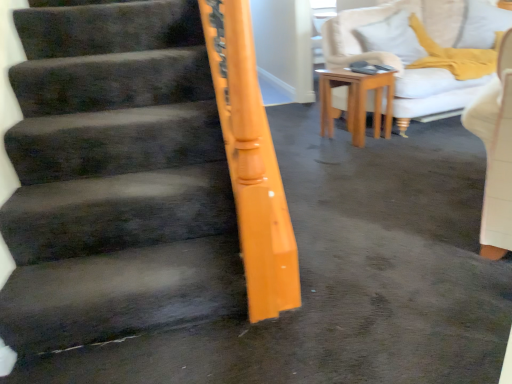
This screenshot has width=512, height=384. What do you see at coordinates (355, 101) in the screenshot? I see `light brown wooden table at center` at bounding box center [355, 101].

I want to click on light brown wooden table at center, so click(355, 101).

Identify the location of white soft pillow at upper right. (392, 37).

What do you see at coordinates (392, 37) in the screenshot? This screenshot has height=384, width=512. I see `white soft pillow at upper right` at bounding box center [392, 37].

Where is `light brown wooden table at center`? The width and height of the screenshot is (512, 384). light brown wooden table at center is located at coordinates (355, 101).

Can you confirm if white soft pillow at upper right is positioned to the right of light brown wooden table at center?

Indeed, white soft pillow at upper right is positioned on the right side of light brown wooden table at center.

Is white soft pillow at upper right in front of or behind light brown wooden table at center in the image?

In the image, white soft pillow at upper right appears behind light brown wooden table at center.

Between point (398, 41) and point (332, 86), which one is positioned behind?

Positioned behind is point (398, 41).

From the image's perspective, is white soft pillow at upper right located above or below light brown wooden table at center?

white soft pillow at upper right is situated higher than light brown wooden table at center in the image.

Looking at this image, from a real-world perspective, which is physically above, white soft pillow at upper right or light brown wooden table at center?

white soft pillow at upper right, from a real-world perspective.

Between white soft pillow at upper right and light brown wooden table at center, which one has larger width?

light brown wooden table at center.

Considering the sizes of white soft pillow at upper right and light brown wooden table at center in the image, is white soft pillow at upper right taller or shorter than light brown wooden table at center?

In the image, white soft pillow at upper right appears to be shorter than light brown wooden table at center.

Between white soft pillow at upper right and light brown wooden table at center, which one has smaller size?

light brown wooden table at center.

Would you say white soft pillow at upper right contains light brown wooden table at center?

That's incorrect, light brown wooden table at center is not inside white soft pillow at upper right.

Does white soft pillow at upper right touch light brown wooden table at center?

No, white soft pillow at upper right is not touching light brown wooden table at center.

Does white soft pillow at upper right turn towards light brown wooden table at center?

No.

Can you tell me how much white soft pillow at upper right and light brown wooden table at center differ in facing direction?

0.776 degrees.

This screenshot has width=512, height=384. Find the location of `pillow behind the light brown wooden table at center`. pillow behind the light brown wooden table at center is located at coordinates (392, 37).

Considering the positions of objects light brown wooden table at center and white soft pillow at upper right in the image provided, who is more to the right, light brown wooden table at center or white soft pillow at upper right?

From the viewer's perspective, white soft pillow at upper right appears more on the right side.

In the image, is light brown wooden table at center positioned in front of or behind white soft pillow at upper right?

Clearly, light brown wooden table at center is in front of white soft pillow at upper right.

Considering the positions of point (360, 82) and point (392, 48), is point (360, 82) closer or farther from the camera than point (392, 48)?

Point (360, 82) appears to be closer to the viewer than point (392, 48).

From the image's perspective, would you say light brown wooden table at center is shown under white soft pillow at upper right?

Correct, light brown wooden table at center appears lower than white soft pillow at upper right in the image.

Looking at this image, from a real-world perspective, relative to white soft pillow at upper right, is light brown wooden table at center vertically above or below?

Clearly, from a real-world perspective, light brown wooden table at center is below white soft pillow at upper right.

Is light brown wooden table at center thinner than white soft pillow at upper right?

Incorrect, the width of light brown wooden table at center is not less than that of white soft pillow at upper right.

Between light brown wooden table at center and white soft pillow at upper right, which one has more height?

light brown wooden table at center is taller.

Considering the sizes of objects light brown wooden table at center and white soft pillow at upper right in the image provided, who is smaller, light brown wooden table at center or white soft pillow at upper right?

Smaller between the two is light brown wooden table at center.

Is light brown wooden table at center inside or outside of white soft pillow at upper right?

light brown wooden table at center is spatially situated outside white soft pillow at upper right.

Is light brown wooden table at center in contact with white soft pillow at upper right?

They are not placed beside each other.

Is light brown wooden table at center positioned with its back to white soft pillow at upper right?

light brown wooden table at center does not have its back to white soft pillow at upper right.

What's the angular difference between light brown wooden table at center and white soft pillow at upper right's facing directions?

0.776 degrees separate the facing orientations of light brown wooden table at center and white soft pillow at upper right.

Identify the location of pillow located above the light brown wooden table at center (from a real-world perspective). coord(392,37).

Where is `pillow behind the light brown wooden table at center`? The image size is (512, 384). pillow behind the light brown wooden table at center is located at coordinates pyautogui.click(x=392, y=37).

Locate an element on the screen. The width and height of the screenshot is (512, 384). table on the left of white soft pillow at upper right is located at coordinates (355, 101).